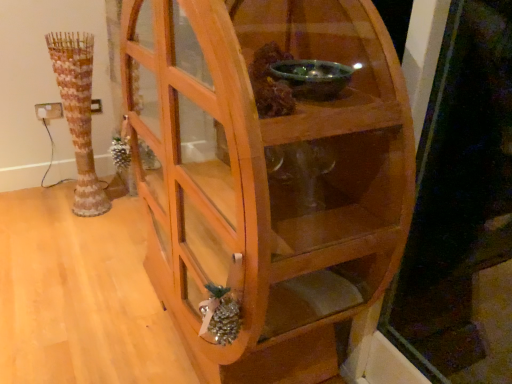
Where is `free spot to the left of wooden cabinet at center`? The width and height of the screenshot is (512, 384). free spot to the left of wooden cabinet at center is located at coordinates (87, 300).